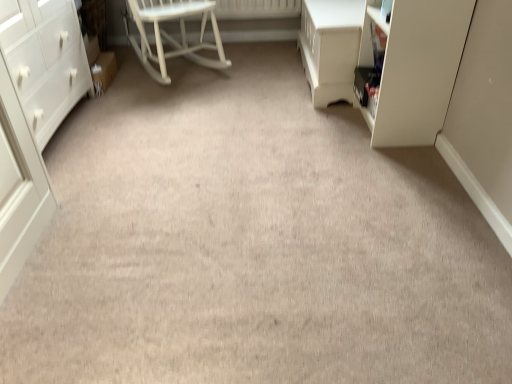
Where is `white matte chest of drawers at left`? The height and width of the screenshot is (384, 512). white matte chest of drawers at left is located at coordinates (33, 116).

Considering the sizes of objects white wood rocking chair at center and matte white cabinet at right in the image provided, who is taller, white wood rocking chair at center or matte white cabinet at right?

With more height is matte white cabinet at right.

Between white wood rocking chair at center and matte white cabinet at right, which one is positioned behind?

white wood rocking chair at center is further from the camera.

Consider the image. Between white wood rocking chair at center and matte white cabinet at right, which one has larger size?

With larger size is white wood rocking chair at center.

Does matte white cabinet at right have a greater height compared to white matte chest of drawers at left?

Incorrect, the height of matte white cabinet at right is not larger of that of white matte chest of drawers at left.

Can you see matte white cabinet at right touching white matte chest of drawers at left?

matte white cabinet at right and white matte chest of drawers at left are not in contact.

From a real-world perspective, which is physically below, matte white cabinet at right or white matte chest of drawers at left?

matte white cabinet at right is physically lower.

Based on the photo, is matte white cabinet at right thinner than white matte chest of drawers at left?

Yes.

Is there a large distance between white wood rocking chair at center and white matte chest of drawers at left?

white wood rocking chair at center is actually quite close to white matte chest of drawers at left.

Consider the image. Is white wood rocking chair at center at the right side of white matte chest of drawers at left?

Yes.

From the image's perspective, is white wood rocking chair at center located beneath white matte chest of drawers at left?

Incorrect, from the image's perspective, white wood rocking chair at center is higher than white matte chest of drawers at left.

Is white wood rocking chair at center positioned behind white matte chest of drawers at left?

Yes, white wood rocking chair at center is behind white matte chest of drawers at left.

Would you say white glossy vanity at upper right contains white wood rocking chair at center?

No, white wood rocking chair at center is located outside of white glossy vanity at upper right.

Considering the points (349, 31) and (127, 35), which point is in front, point (349, 31) or point (127, 35)?

Point (349, 31)

Is white glossy vanity at upper right at the right side of matte white cabinet at right?

No, white glossy vanity at upper right is not to the right of matte white cabinet at right.

Is point (350, 79) closer or farther from the camera than point (399, 135)?

Point (350, 79).

From the image's perspective, does white glossy vanity at upper right appear lower than matte white cabinet at right?

No, from the image's perspective, white glossy vanity at upper right is not beneath matte white cabinet at right.

Is white matte chest of drawers at left turned away from matte white cabinet at right?

white matte chest of drawers at left is not turned away from matte white cabinet at right.

Does point (62, 116) come behind point (381, 124)?

Yes, point (62, 116) is behind point (381, 124).

Can you tell me how much white matte chest of drawers at left and matte white cabinet at right differ in facing direction?

white matte chest of drawers at left and matte white cabinet at right are facing 180 degrees away from each other.

Are white matte chest of drawers at left and matte white cabinet at right making contact?

No, white matte chest of drawers at left is not making contact with matte white cabinet at right.

Considering the sizes of white wood rocking chair at center and white glossy vanity at upper right in the image, is white wood rocking chair at center bigger or smaller than white glossy vanity at upper right?

white wood rocking chair at center is bigger than white glossy vanity at upper right.

Can white glossy vanity at upper right be found inside white wood rocking chair at center?

No, white glossy vanity at upper right is not a part of white wood rocking chair at center.

From the image's perspective, is white wood rocking chair at center beneath white glossy vanity at upper right?

No.

Is white wood rocking chair at center taller than white glossy vanity at upper right?

Correct, white wood rocking chair at center is much taller as white glossy vanity at upper right.

This screenshot has height=384, width=512. Find the location of `cabinetry lying below the white wood rocking chair at center (from the image's perspective)`. cabinetry lying below the white wood rocking chair at center (from the image's perspective) is located at coordinates (415, 67).

Where is `chest of drawers on the left of matte white cabinet at right`? Image resolution: width=512 pixels, height=384 pixels. chest of drawers on the left of matte white cabinet at right is located at coordinates click(x=33, y=116).

Looking at this image, when comparing their distances from white glossy vanity at upper right, does matte white cabinet at right or white matte chest of drawers at left seem further?

The object further to white glossy vanity at upper right is white matte chest of drawers at left.

From the picture: Estimate the real-world distances between objects in this image. Which object is closer to white matte chest of drawers at left, white glossy vanity at upper right or white wood rocking chair at center?

white wood rocking chair at center.

Looking at the image, which one is located closer to white glossy vanity at upper right, white wood rocking chair at center or white matte chest of drawers at left?

white wood rocking chair at center is closer to white glossy vanity at upper right.

Estimate the real-world distances between objects in this image. Which object is further from white wood rocking chair at center, white matte chest of drawers at left or white glossy vanity at upper right?

→ Among the two, white glossy vanity at upper right is located further to white wood rocking chair at center.

Considering their positions, is matte white cabinet at right positioned further to white wood rocking chair at center than white glossy vanity at upper right?

The object further to white wood rocking chair at center is matte white cabinet at right.

Based on the photo, from the image, which object appears to be nearer to matte white cabinet at right, white wood rocking chair at center or white matte chest of drawers at left?

white wood rocking chair at center.

Based on their spatial positions, is white wood rocking chair at center or matte white cabinet at right further from white matte chest of drawers at left?

Among the two, matte white cabinet at right is located further to white matte chest of drawers at left.

Consider the image. Looking at the image, which one is located closer to white matte chest of drawers at left, white glossy vanity at upper right or matte white cabinet at right?

Among the two, white glossy vanity at upper right is located nearer to white matte chest of drawers at left.

Where is `vanity between white wood rocking chair at center and matte white cabinet at right in the horizontal direction`? vanity between white wood rocking chair at center and matte white cabinet at right in the horizontal direction is located at coordinates (330, 47).

The height and width of the screenshot is (384, 512). Find the location of `chair between white matte chest of drawers at left and white glossy vanity at upper right`. chair between white matte chest of drawers at left and white glossy vanity at upper right is located at coordinates (170, 36).

Locate an element on the screen. vanity between white matte chest of drawers at left and matte white cabinet at right from left to right is located at coordinates (330, 47).

The height and width of the screenshot is (384, 512). In order to click on chair situated between white matte chest of drawers at left and matte white cabinet at right from left to right in this screenshot , I will do `click(170, 36)`.